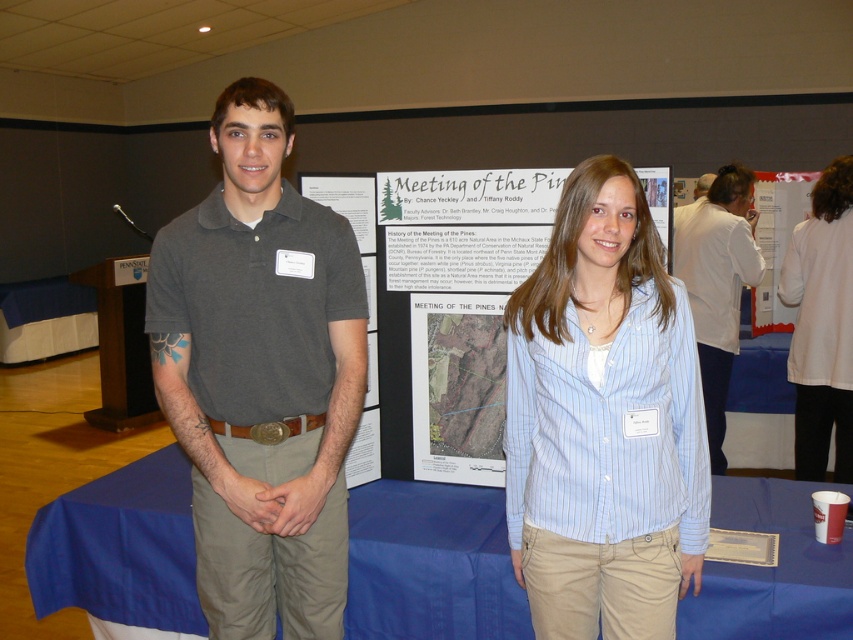
Question: Considering the relative positions of white cotton shirt at upper center and white striped shirt at center in the image provided, where is white cotton shirt at upper center located with respect to white striped shirt at center?

Choices:
 (A) below
 (B) above

Answer: (B)

Question: Is white cotton shirt at upper center positioned at the back of white striped shirt at center?

Choices:
 (A) yes
 (B) no

Answer: (B)

Question: Which object is positioned farthest from the blue fabric tablecloth at center?

Choices:
 (A) white striped shirt at center
 (B) matte gray shirt at center

Answer: (A)

Question: Among these points, which one is farthest from the camera?

Choices:
 (A) (834, 188)
 (B) (606, 392)
 (C) (410, 504)
 (D) (685, 227)

Answer: (D)

Question: Does matte gray shirt at center come in front of blue fabric tablecloth at center?

Choices:
 (A) yes
 (B) no

Answer: (A)

Question: Which point is closer to the camera taking this photo?

Choices:
 (A) (724, 356)
 (B) (306, 512)
 (C) (813, 436)

Answer: (B)